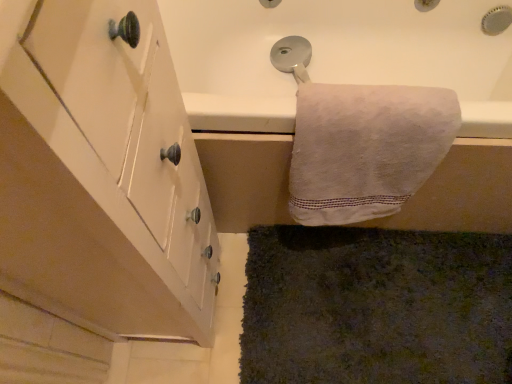
Question: Is dark green shaggy carpet at lower right to the right of white cotton towel at upper right from the viewer's perspective?

Choices:
 (A) yes
 (B) no

Answer: (A)

Question: Does dark green shaggy carpet at lower right turn towards white cotton towel at upper right?

Choices:
 (A) yes
 (B) no

Answer: (B)

Question: Is dark green shaggy carpet at lower right far from white cotton towel at upper right?

Choices:
 (A) yes
 (B) no

Answer: (B)

Question: From the image's perspective, does dark green shaggy carpet at lower right appear lower than white cotton towel at upper right?

Choices:
 (A) no
 (B) yes

Answer: (B)

Question: From a real-world perspective, is dark green shaggy carpet at lower right physically above white cotton towel at upper right?

Choices:
 (A) no
 (B) yes

Answer: (A)

Question: Is dark green shaggy carpet at lower right bigger or smaller than white matte cabinet at left?

Choices:
 (A) small
 (B) big

Answer: (A)

Question: In terms of height, does dark green shaggy carpet at lower right look taller or shorter compared to white matte cabinet at left?

Choices:
 (A) tall
 (B) short

Answer: (B)

Question: Looking at their shapes, would you say dark green shaggy carpet at lower right is wider or thinner than white matte cabinet at left?

Choices:
 (A) thin
 (B) wide

Answer: (B)

Question: Is dark green shaggy carpet at lower right in front of or behind white matte cabinet at left in the image?

Choices:
 (A) behind
 (B) front

Answer: (A)

Question: In the image, is white matte cabinet at left on the left side or the right side of dark green shaggy carpet at lower right?

Choices:
 (A) right
 (B) left

Answer: (B)

Question: Considering the positions of white matte cabinet at left and dark green shaggy carpet at lower right in the image, is white matte cabinet at left wider or thinner than dark green shaggy carpet at lower right?

Choices:
 (A) thin
 (B) wide

Answer: (A)

Question: Relative to dark green shaggy carpet at lower right, is white matte cabinet at left in front or behind?

Choices:
 (A) front
 (B) behind

Answer: (A)

Question: Is point (111, 43) closer or farther from the camera than point (271, 233)?

Choices:
 (A) farther
 (B) closer

Answer: (B)

Question: From a real-world perspective, relative to white cotton towel at upper right, is white matte cabinet at left vertically above or below?

Choices:
 (A) above
 (B) below

Answer: (A)

Question: Looking at their shapes, would you say white matte cabinet at left is wider or thinner than white cotton towel at upper right?

Choices:
 (A) thin
 (B) wide

Answer: (B)